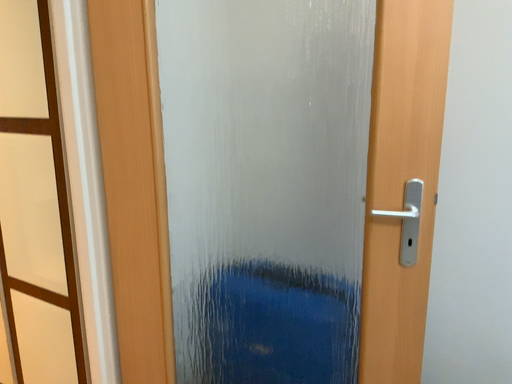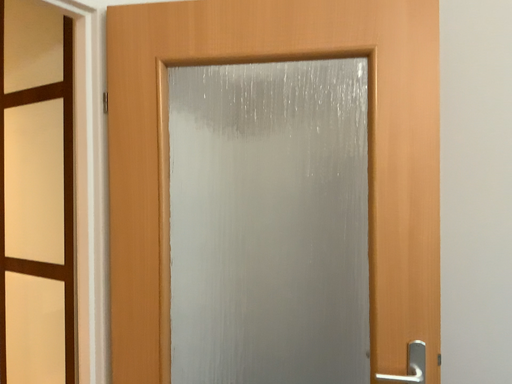
Question: How did the camera likely rotate when shooting the video?

Choices:
 (A) rotated downward
 (B) rotated upward

Answer: (B)